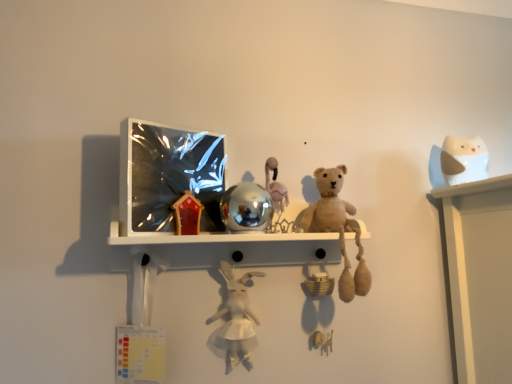
Question: Does point (240, 221) appear closer or farther from the camera than point (454, 153)?

Choices:
 (A) farther
 (B) closer

Answer: (B)

Question: Looking at their shapes, would you say shiny metallic ball at center, which is counted as the third toy, starting from the right, is wider or thinner than white matte owl at upper right, positioned as the 1th toy in right-to-left order?

Choices:
 (A) wide
 (B) thin

Answer: (A)

Question: Which object is the closest to the fuzzy beige teddy bear at center, the third toy when ordered from left to right?

Choices:
 (A) white plush rabbit at center, which is the first toy in left-to-right order
 (B) metallic reflective shelf at center
 (C) shiny metallic ball at center, which is counted as the second toy, starting from the left
 (D) white matte owl at upper right, which appears as the 4th toy when viewed from the left

Answer: (B)

Question: Estimate the real-world distances between objects in this image. Which object is farther from the metallic reflective shelf at center?

Choices:
 (A) shiny metallic ball at center, which is counted as the second toy, starting from the left
 (B) white plush rabbit at center, which appears as the 4th toy when viewed from the right
 (C) white matte owl at upper right, positioned as the 1th toy in right-to-left order
 (D) fuzzy beige teddy bear at center, marked as the second toy in a right-to-left arrangement

Answer: (C)